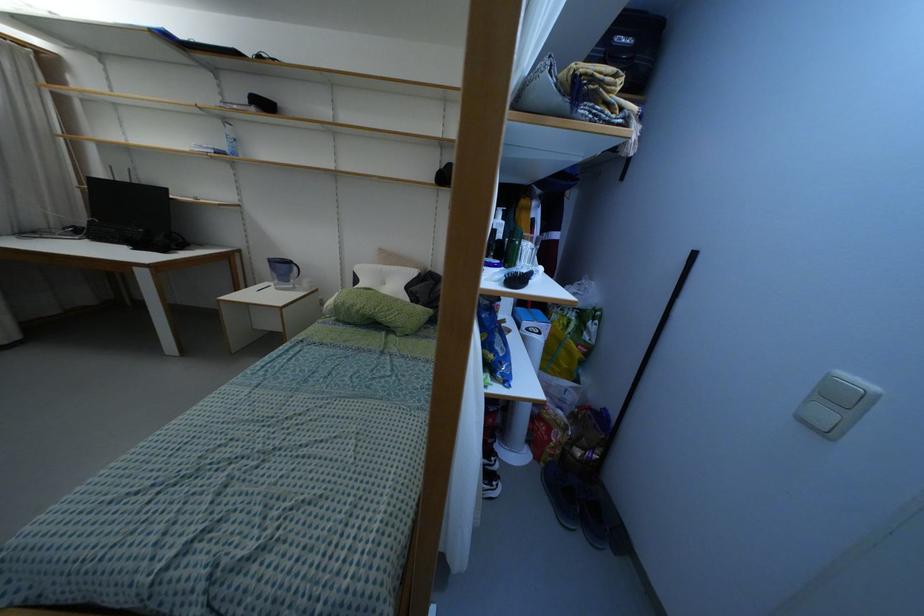
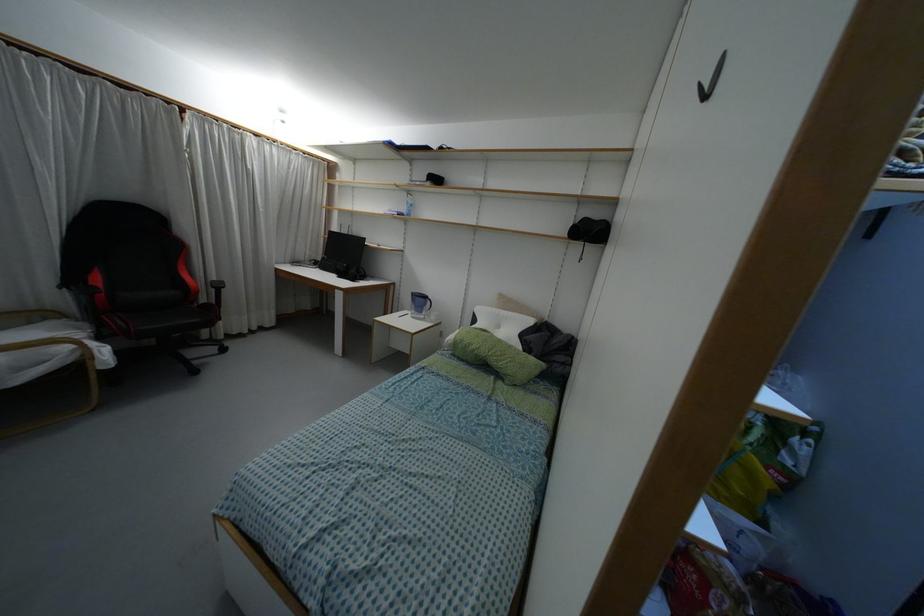
Question: Based on the continuous images, in which direction is the camera rotating? Reply with the corresponding letter.

Choices:
 (A) Left
 (B) Right
 (C) Up
 (D) Down

Answer: (A)